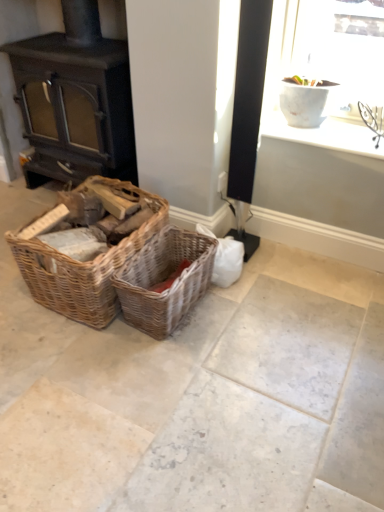
How much space does woven wood basket at left, the 1th picnic basket when ordered from left to right, occupy vertically?

It is 15.20 inches.

Measure the distance between point (x=331, y=139) and camera.

They are 6.30 feet apart.

The width and height of the screenshot is (384, 512). Find the location of `matte black wood burning stove at left`. matte black wood burning stove at left is located at coordinates (75, 100).

Locate an element on the screen. The image size is (384, 512). woven wood basket at left, the 1th picnic basket when ordered from left to right is located at coordinates (84, 267).

From the image's perspective, is white ceramic vase at upper right located above or below matte black wood burning stove at left?

From the image's perspective, white ceramic vase at upper right appears below matte black wood burning stove at left.

Can we say white ceramic vase at upper right lies outside matte black wood burning stove at left?

white ceramic vase at upper right lies outside matte black wood burning stove at left's area.

Based on the photo, between white ceramic vase at upper right and matte black wood burning stove at left, which one appears on the left side from the viewer's perspective?

Positioned to the left is matte black wood burning stove at left.

Relative to woven brown picnic basket at center, the 1th picnic basket positioned from the right, is matte black wood burning stove at left in front or behind?

matte black wood burning stove at left is positioned farther from the viewer than woven brown picnic basket at center, the 1th picnic basket positioned from the right.

From the image's perspective, is matte black wood burning stove at left beneath woven brown picnic basket at center, placed as the second picnic basket when sorted from left to right?

No.

Identify the location of wood burning stove above the woven brown picnic basket at center, placed as the second picnic basket when sorted from left to right (from the image's perspective). The image size is (384, 512). (75, 100).

Does woven wood basket at left, the second picnic basket in the right-to-left sequence, turn towards matte black wood burning stove at left?

No, woven wood basket at left, the second picnic basket in the right-to-left sequence, does not turn towards matte black wood burning stove at left.

Who is taller, woven wood basket at left, the 1th picnic basket when ordered from left to right, or matte black wood burning stove at left?

Standing taller between the two is matte black wood burning stove at left.

The image size is (384, 512). Identify the location of wood burning stove above the woven wood basket at left, the 1th picnic basket when ordered from left to right (from a real-world perspective). (75, 100).

Which is closer, (37, 281) or (41, 66)?

The point (37, 281) is in front.

Between matte black wood burning stove at left and woven wood basket at left, the 1th picnic basket when ordered from left to right, which one has smaller size?

Smaller between the two is woven wood basket at left, the 1th picnic basket when ordered from left to right.

In the scene shown: From their relative heights in the image, would you say matte black wood burning stove at left is taller or shorter than woven wood basket at left, the second picnic basket in the right-to-left sequence?

Clearly, matte black wood burning stove at left is taller compared to woven wood basket at left, the second picnic basket in the right-to-left sequence.

Which object is more forward, matte black wood burning stove at left or woven wood basket at left, the second picnic basket in the right-to-left sequence?

woven wood basket at left, the second picnic basket in the right-to-left sequence, is closer to the camera.

Which of these two, matte black wood burning stove at left or woven wood basket at left, the 1th picnic basket when ordered from left to right, is wider?

woven wood basket at left, the 1th picnic basket when ordered from left to right, is wider.

Considering the positions of objects woven wood basket at left, the 1th picnic basket when ordered from left to right, and white ceramic vase at upper right in the image provided, who is more to the left, woven wood basket at left, the 1th picnic basket when ordered from left to right, or white ceramic vase at upper right?

woven wood basket at left, the 1th picnic basket when ordered from left to right, is more to the left.

Is woven wood basket at left, the second picnic basket in the right-to-left sequence, wider or thinner than white ceramic vase at upper right?

In the image, woven wood basket at left, the second picnic basket in the right-to-left sequence, appears to be wider than white ceramic vase at upper right.

Who is bigger, woven wood basket at left, the second picnic basket in the right-to-left sequence, or white ceramic vase at upper right?

woven wood basket at left, the second picnic basket in the right-to-left sequence.

Who is shorter, woven wood basket at left, the 1th picnic basket when ordered from left to right, or white ceramic vase at upper right?

With less height is white ceramic vase at upper right.

Is white ceramic vase at upper right turned away from woven brown picnic basket at center, placed as the second picnic basket when sorted from left to right?

No, white ceramic vase at upper right is not facing away from woven brown picnic basket at center, placed as the second picnic basket when sorted from left to right.

Is white ceramic vase at upper right to the left or to the right of woven brown picnic basket at center, placed as the second picnic basket when sorted from left to right, in the image?

From the image, it's evident that white ceramic vase at upper right is to the right of woven brown picnic basket at center, placed as the second picnic basket when sorted from left to right.

Considering the relative sizes of white ceramic vase at upper right and woven brown picnic basket at center, the 1th picnic basket positioned from the right, in the image provided, is white ceramic vase at upper right shorter than woven brown picnic basket at center, the 1th picnic basket positioned from the right,?

Yes, white ceramic vase at upper right is shorter than woven brown picnic basket at center, the 1th picnic basket positioned from the right.

Locate an element on the screen. The height and width of the screenshot is (512, 384). picnic basket that is the 1st object to the left of the white ceramic vase at upper right, starting at the anchor is located at coordinates (164, 280).

Considering the sizes of objects woven wood basket at left, the 1th picnic basket when ordered from left to right, and woven brown picnic basket at center, the 1th picnic basket positioned from the right, in the image provided, who is smaller, woven wood basket at left, the 1th picnic basket when ordered from left to right, or woven brown picnic basket at center, the 1th picnic basket positioned from the right,?

With smaller size is woven brown picnic basket at center, the 1th picnic basket positioned from the right.

Can you tell me how much woven wood basket at left, the 1th picnic basket when ordered from left to right, and woven brown picnic basket at center, the 1th picnic basket positioned from the right, differ in facing direction?

They differ by 2.85 degrees in their facing directions.

From the image's perspective, is woven wood basket at left, the 1th picnic basket when ordered from left to right, under woven brown picnic basket at center, the 1th picnic basket positioned from the right?

Incorrect, from the image's perspective, woven wood basket at left, the 1th picnic basket when ordered from left to right, is higher than woven brown picnic basket at center, the 1th picnic basket positioned from the right.

Is woven wood basket at left, the second picnic basket in the right-to-left sequence, inside or outside of woven brown picnic basket at center, placed as the second picnic basket when sorted from left to right?

The correct answer is: outside.

At what (x,y) coordinates should I click in order to perform the action: click on window sill located on the right of matte black wood burning stove at left. Please return your answer as a coordinate pair (x, y). The height and width of the screenshot is (512, 384). Looking at the image, I should click on (324, 134).

From a real-world perspective, starting from the matte black wood burning stove at left, which picnic basket is the 2nd one below it? Please provide its 2D coordinates.

[(164, 280)]

Based on their spatial positions, is woven wood basket at left, the second picnic basket in the right-to-left sequence, or matte black wood burning stove at left closer to woven brown picnic basket at center, placed as the second picnic basket when sorted from left to right?

woven wood basket at left, the second picnic basket in the right-to-left sequence.

Which object lies nearer to the anchor point woven brown picnic basket at center, the 1th picnic basket positioned from the right, woven wood basket at left, the 1th picnic basket when ordered from left to right, or white ceramic vase at upper right?

woven wood basket at left, the 1th picnic basket when ordered from left to right, is positioned closer to the anchor woven brown picnic basket at center, the 1th picnic basket positioned from the right.

When comparing their distances from woven wood basket at left, the second picnic basket in the right-to-left sequence, does woven brown picnic basket at center, placed as the second picnic basket when sorted from left to right, or matte black wood burning stove at left seem closer?

woven brown picnic basket at center, placed as the second picnic basket when sorted from left to right, is closer to woven wood basket at left, the second picnic basket in the right-to-left sequence.

Considering their positions, is white ceramic vase at upper right positioned closer to woven brown picnic basket at center, placed as the second picnic basket when sorted from left to right, than woven wood basket at left, the second picnic basket in the right-to-left sequence?

woven wood basket at left, the second picnic basket in the right-to-left sequence.

Which object lies further to the anchor point woven brown picnic basket at center, the 1th picnic basket positioned from the right, matte black wood burning stove at left or woven wood basket at left, the 1th picnic basket when ordered from left to right?

The object further to woven brown picnic basket at center, the 1th picnic basket positioned from the right, is matte black wood burning stove at left.

When comparing their distances from white ceramic vase at upper right, does woven brown picnic basket at center, placed as the second picnic basket when sorted from left to right, or woven wood basket at left, the 1th picnic basket when ordered from left to right, seem closer?

Based on the image, woven brown picnic basket at center, placed as the second picnic basket when sorted from left to right, appears to be nearer to white ceramic vase at upper right.

In the scene shown: Estimate the real-world distances between objects in this image. Which object is closer to matte black wood burning stove at left, woven brown picnic basket at center, placed as the second picnic basket when sorted from left to right, or white ceramic vase at upper right?

woven brown picnic basket at center, placed as the second picnic basket when sorted from left to right.

From the image, which object appears to be farther from white ceramic vase at upper right, matte black wood burning stove at left or woven wood basket at left, the 1th picnic basket when ordered from left to right?

matte black wood burning stove at left is positioned further to the anchor white ceramic vase at upper right.

At what (x,y) coordinates should I click in order to perform the action: click on picnic basket between matte black wood burning stove at left and woven brown picnic basket at center, placed as the second picnic basket when sorted from left to right, in the up-down direction. Please return your answer as a coordinate pair (x, y). Image resolution: width=384 pixels, height=512 pixels. Looking at the image, I should click on (84, 267).

Locate an element on the screen. picnic basket between woven wood basket at left, the 1th picnic basket when ordered from left to right, and white ceramic vase at upper right from left to right is located at coordinates tap(164, 280).